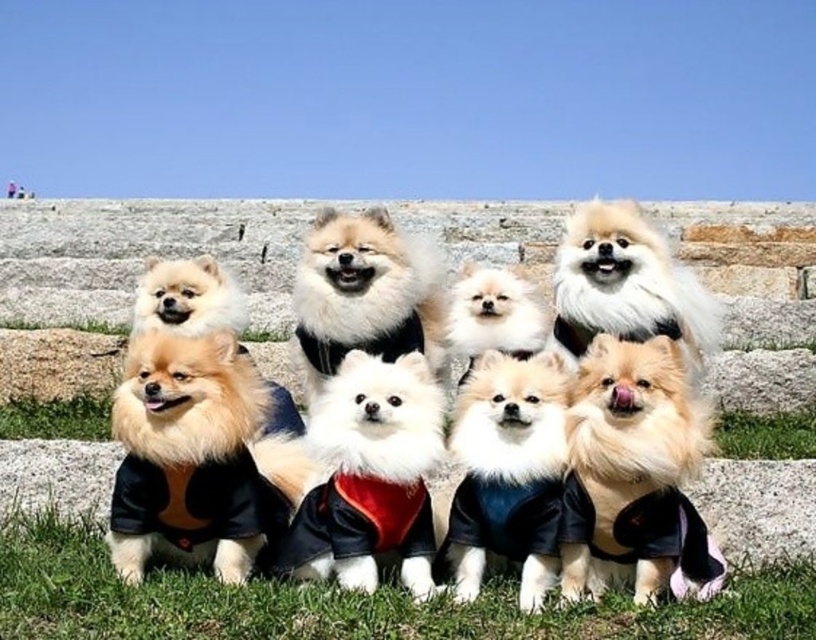
Can you confirm if fluffy white dog at center is positioned to the left of fluffy white fur at center?

Indeed, fluffy white dog at center is positioned on the left side of fluffy white fur at center.

Is fluffy white dog at center positioned in front of fluffy white fur at center?

No, it is behind fluffy white fur at center.

This screenshot has height=640, width=816. I want to click on fluffy white dog at center, so click(x=191, y=404).

In order to click on fluffy white dog at center in this screenshot , I will do click(191, 404).

Who is higher up, green grass at lower center or fluffy white fur at center?

Positioned higher is fluffy white fur at center.

Is green grass at lower center taller than fluffy white fur at center?

No, green grass at lower center is not taller than fluffy white fur at center.

Identify the location of green grass at lower center. Image resolution: width=816 pixels, height=640 pixels. (347, 602).

Is fluffy white dog at center in front of white fluffy dog at center?

No, fluffy white dog at center is further to the viewer.

Is fluffy white dog at center below white fluffy dog at center?

No, fluffy white dog at center is not below white fluffy dog at center.

This screenshot has height=640, width=816. Identify the location of fluffy white dog at center. (191, 404).

The width and height of the screenshot is (816, 640). Find the location of `fluffy white dog at center`. fluffy white dog at center is located at coordinates (191, 404).